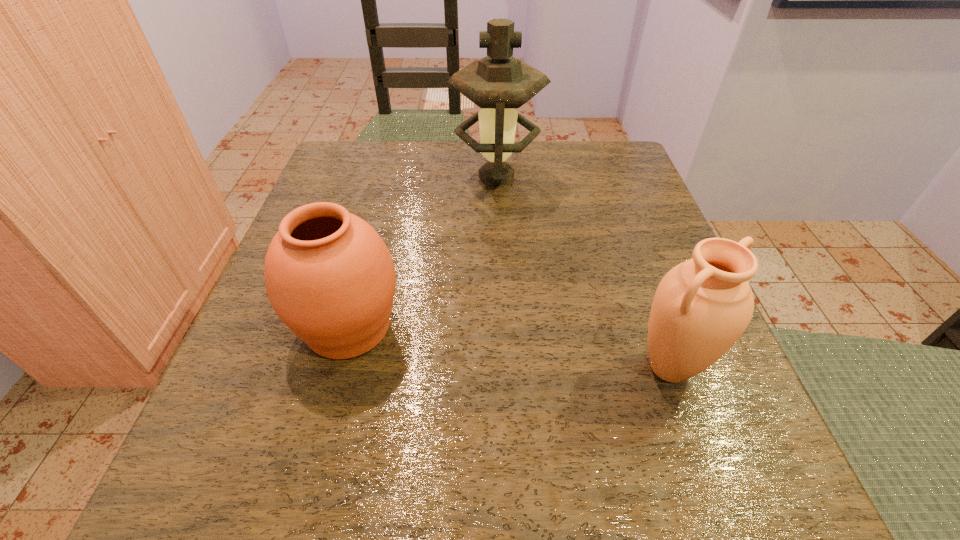
Identify the location of vacant space in between the oil lamp and the right urn. This screenshot has height=540, width=960. (583, 272).

Where is `free spot between the farthest object and the right urn`? free spot between the farthest object and the right urn is located at coordinates (583, 272).

The image size is (960, 540). I want to click on free point between the oil lamp and the right urn, so (583, 272).

This screenshot has width=960, height=540. Identify the location of free spot between the rightmost object and the second object from left to right. (583, 272).

I want to click on free spot between the second object from left to right and the leftmost object, so click(422, 252).

You are a GUI agent. You are given a task and a screenshot of the screen. Output one action in this format:
    pyautogui.click(x=<x>, y=<y>)
    Task: Click on the vacant area between the right urn and the oil lamp
    The width and height of the screenshot is (960, 540).
    Given the screenshot: What is the action you would take?
    pyautogui.click(x=583, y=272)

Select which object is the second closest to the farthest object. Please provide its 2D coordinates. Your answer should be formatted as a tuple, i.e. [(x, y)], where the tuple contains the x and y coordinates of a point satisfying the conditions above.

[(702, 306)]

Identify which object is located as the second nearest to the left urn. Please provide its 2D coordinates. Your answer should be formatted as a tuple, i.e. [(x, y)], where the tuple contains the x and y coordinates of a point satisfying the conditions above.

[(702, 306)]

Identify the location of free spot that satisfies the following two spatial constraints: 1. on the back side of the left urn; 2. on the right side of the second object from right to left. The height and width of the screenshot is (540, 960). (389, 177).